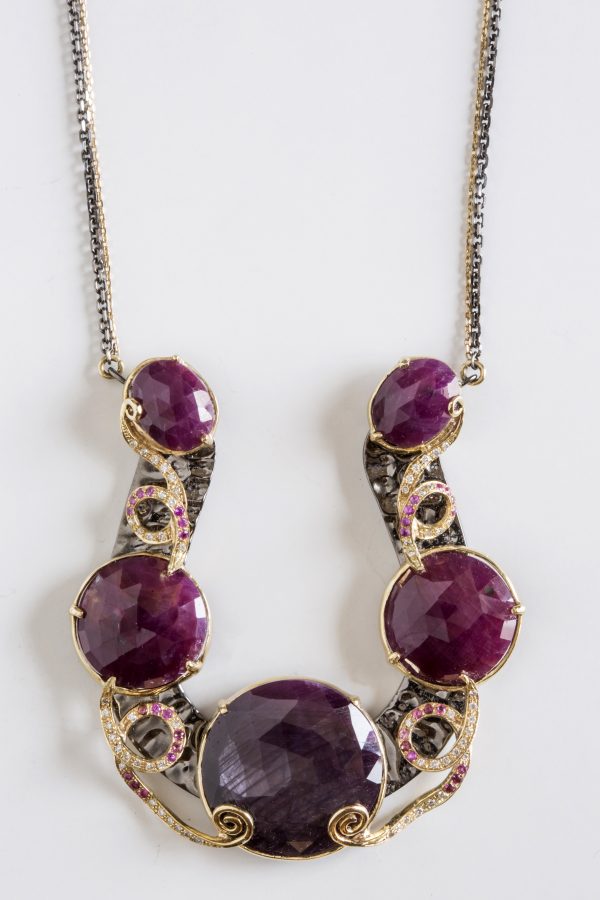
Image resolution: width=600 pixels, height=900 pixels. Find the location of `gold trimmings`. gold trimmings is located at coordinates (220, 812), (335, 821).